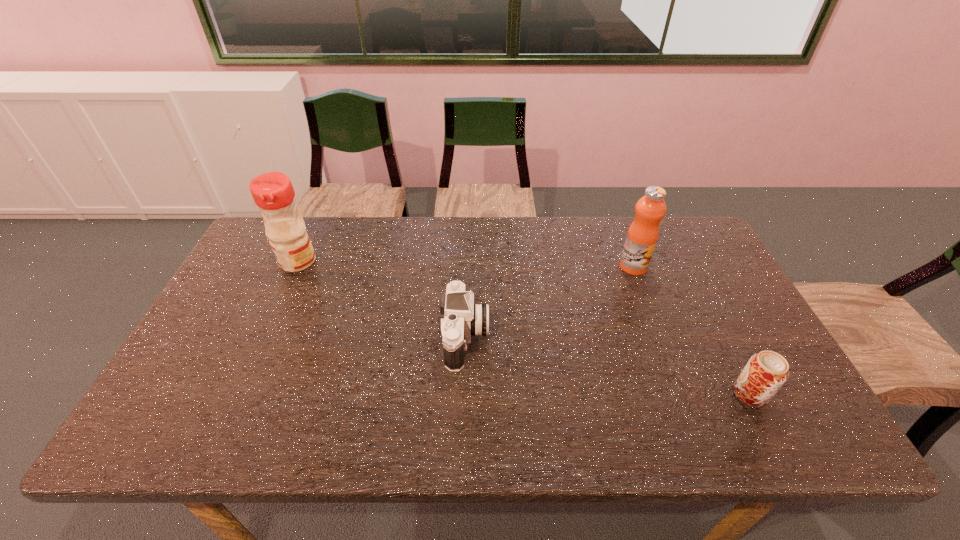
Identify the location of vacant point that satisfies the following two spatial constraints: 1. on the front side of the nearest object; 2. on the right side of the second object from right to left. (682, 394).

Find the location of a particular element. The width and height of the screenshot is (960, 540). blank area in the image that satisfies the following two spatial constraints: 1. on the front side of the condiment; 2. on the left side of the third object from right to left is located at coordinates (263, 338).

Image resolution: width=960 pixels, height=540 pixels. I want to click on vacant region that satisfies the following two spatial constraints: 1. on the front side of the condiment; 2. on the right side of the beer can, so click(237, 394).